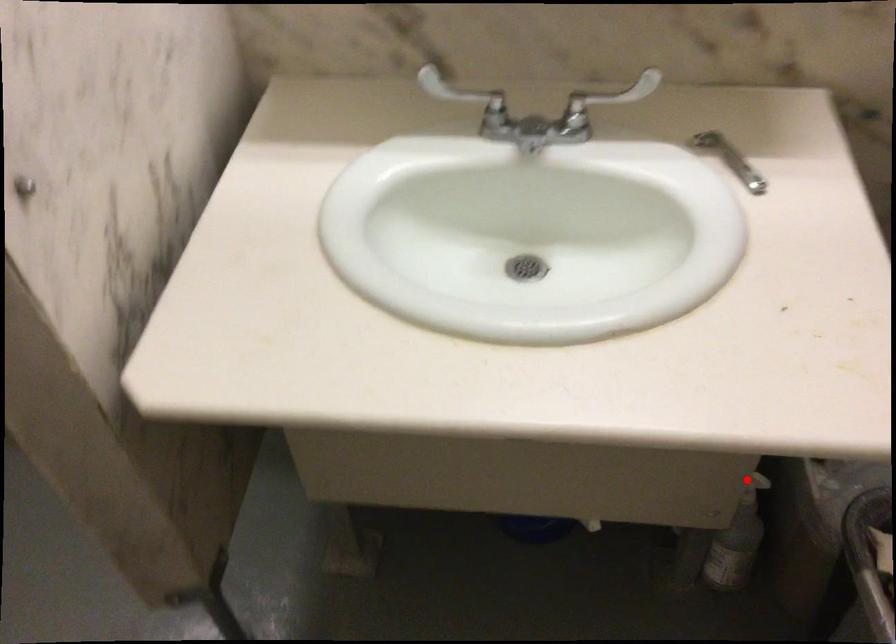
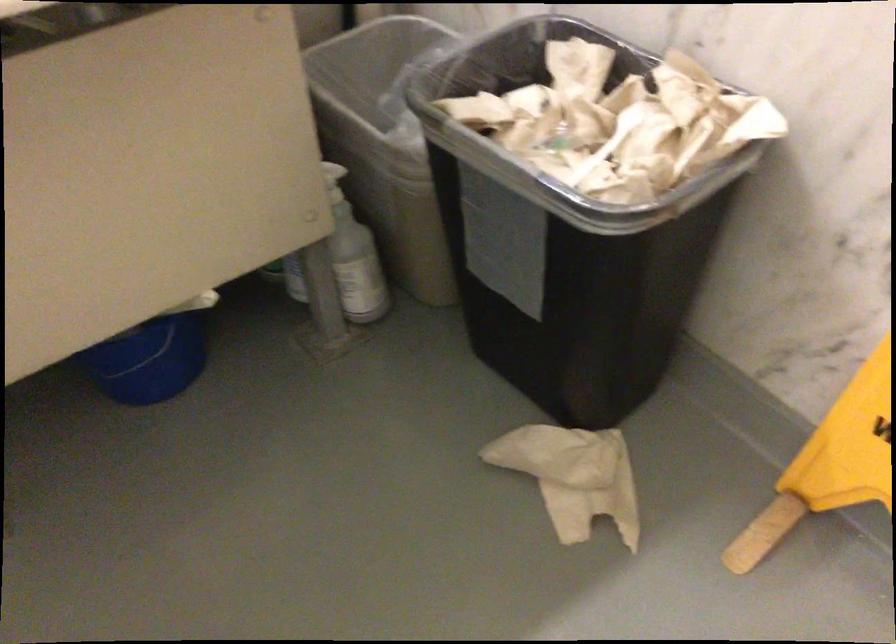
The point at the highlighted location is marked in the first image. Where is the corresponding point in the second image?

(333, 182)